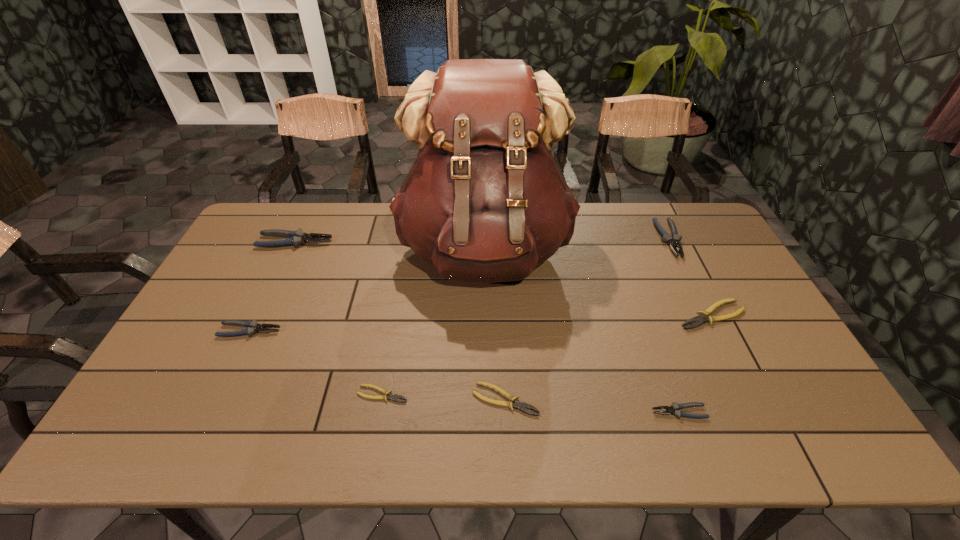
The image size is (960, 540). Identify the location of the third object from right to left. tap(675, 410).

I want to click on the seventh tallest object, so click(517, 404).

At what (x,y) coordinates should I click in order to perform the action: click on the second yellow pliers from left to right. Please return your answer as a coordinate pair (x, y). This screenshot has width=960, height=540. Looking at the image, I should click on (517, 404).

This screenshot has width=960, height=540. I want to click on the third pliers from left to right, so click(x=388, y=395).

The width and height of the screenshot is (960, 540). What are the coordinates of `the shortest object` in the screenshot? It's located at (388, 395).

You are a GUI agent. You are given a task and a screenshot of the screen. Output one action in this format:
    pyautogui.click(x=<x>, y=<y>)
    Task: Click on the free space located at the front of the tallest object with buckles
    Image resolution: width=960 pixels, height=540 pixels.
    Given the screenshot: What is the action you would take?
    pyautogui.click(x=486, y=373)

Locate an element on the screen. vacant position located 0.080m at the gripping part of the seventh shortest object is located at coordinates (355, 242).

The width and height of the screenshot is (960, 540). What are the coordinates of `free space located at the gripping part of the rightmost gray pliers` in the screenshot? It's located at (714, 332).

Where is `vacant space located 0.260m at the gripping part of the third farthest gray pliers`? vacant space located 0.260m at the gripping part of the third farthest gray pliers is located at coordinates (373, 330).

Where is `free space located on the left of the rightmost yellow pliers`? free space located on the left of the rightmost yellow pliers is located at coordinates (596, 315).